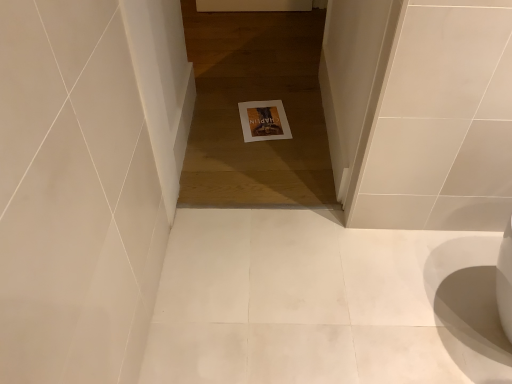
Where is `vacant area situated below white paper at center (from a real-world perspective)`? vacant area situated below white paper at center (from a real-world perspective) is located at coordinates 261,117.